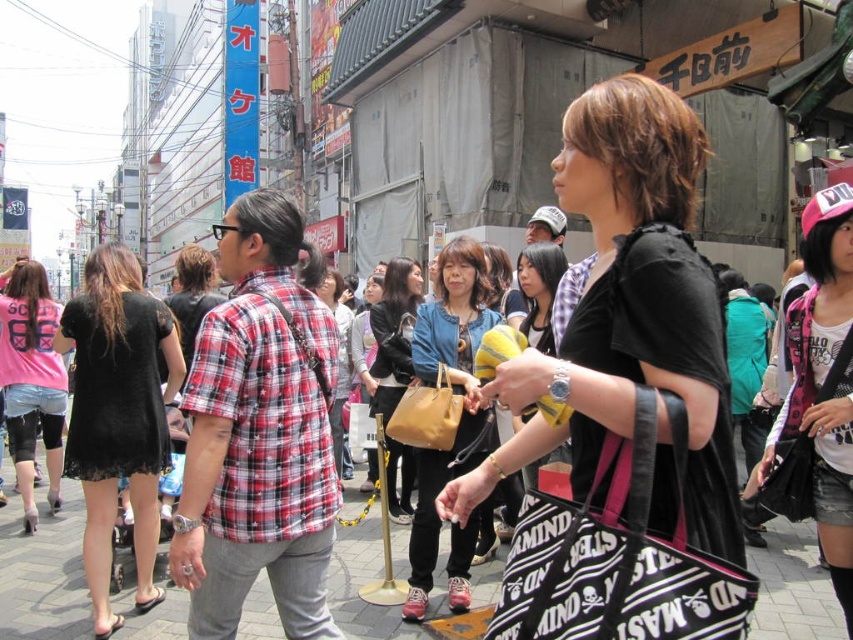
You are a photographer standing on the street and want to take a photo that includes both the black lace dress at left and the pink matte shirt at center. Which object should you focus on first to ensure both are in sharp focus?

You should focus on the black lace dress at left first because it is closer to the viewer than the pink matte shirt at center, so focusing on the closer object will help keep both in focus.

You are standing on the bustling urban street scene and want to find the matte black jacket at center. According to the coordinates provided, where exactly is the matte black jacket located?

The matte black jacket at center is located at point coordinates of 0.522 on the x axis and 0.462 on the y axis.